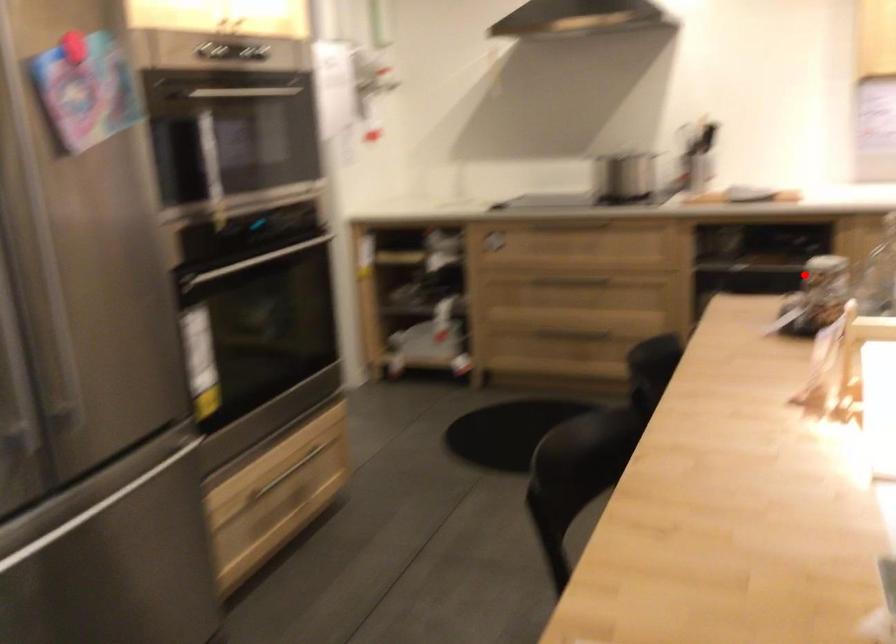
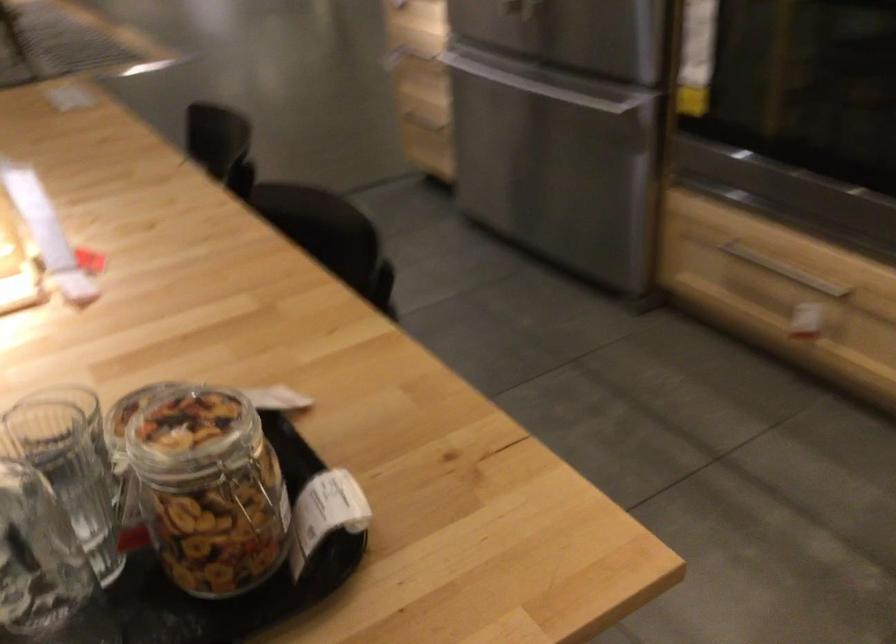
Find the pixel in the second image that matches the highlighted location in the first image.

(250, 493)